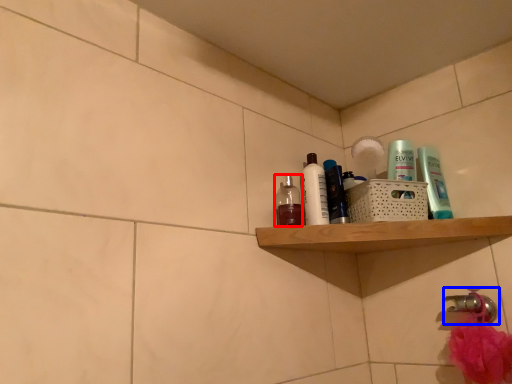
Question: Which object is further to the camera taking this photo, toiletry (highlighted by a red box) or tap (highlighted by a blue box)?

Choices:
 (A) toiletry
 (B) tap

Answer: (A)